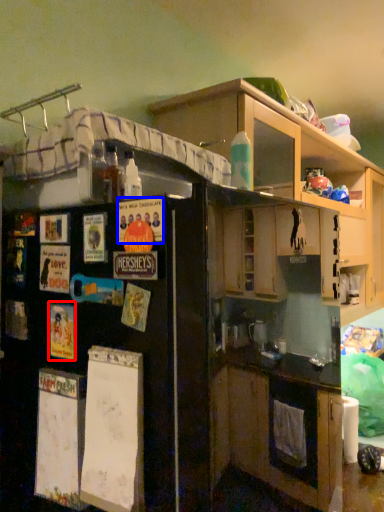
Question: Which object is closer to the camera taking this photo, poster (highlighted by a red box) or poster (highlighted by a blue box)?

Choices:
 (A) poster
 (B) poster

Answer: (B)